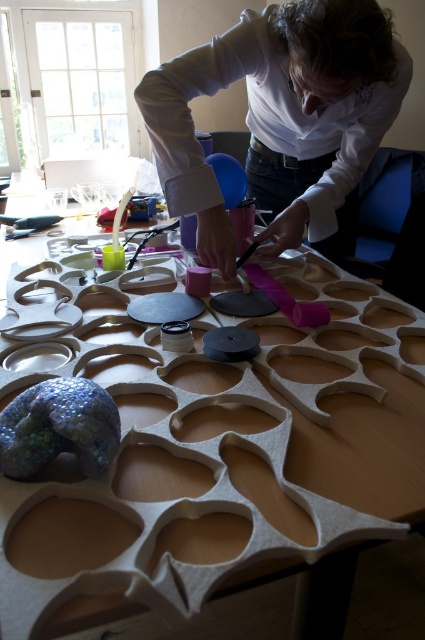
Which of these two, white matte table at center or white matte shirt at upper center, stands shorter?

white matte shirt at upper center

Does point (187, 468) come behind point (300, 3)?

No, it is not.

Measure the distance between point (180, 392) and camera.

Point (180, 392) is 31.02 inches away from camera.

This screenshot has width=425, height=640. I want to click on white matte table at center, so click(215, 456).